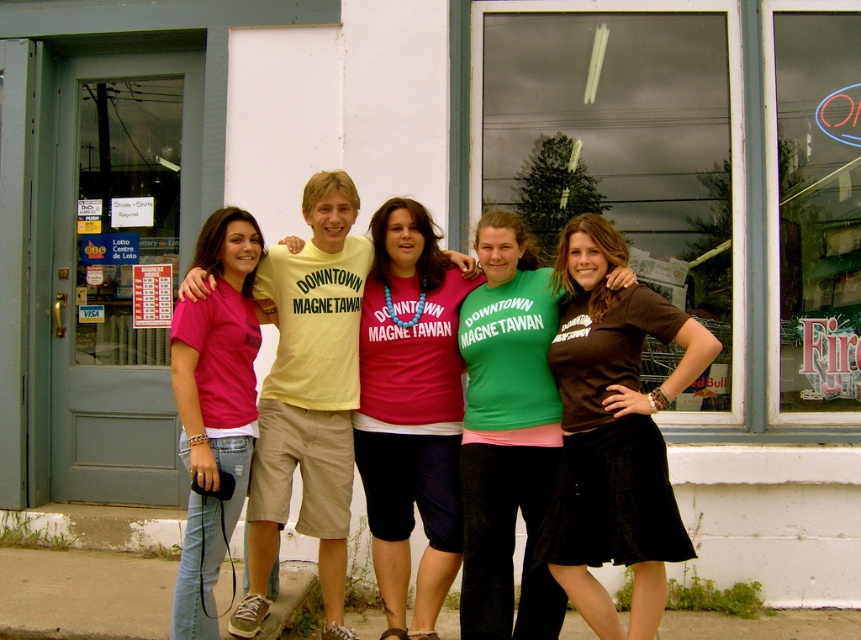
Does matte pink shirt at center have a greater height compared to green matte shirt at center?

Correct, matte pink shirt at center is much taller as green matte shirt at center.

Based on the photo, which is below, matte pink shirt at center or green matte shirt at center?

green matte shirt at center is below.

Which is in front, point (422, 280) or point (462, 472)?

Point (462, 472) is in front.

Image resolution: width=861 pixels, height=640 pixels. I want to click on matte pink shirt at center, so click(410, 412).

Can you confirm if matte pink shirt at center is positioned below matte pink t-shirt at left?

Indeed, matte pink shirt at center is positioned under matte pink t-shirt at left.

Can you confirm if matte pink shirt at center is positioned above matte pink t-shirt at left?

No.

You are a GUI agent. You are given a task and a screenshot of the screen. Output one action in this format:
    pyautogui.click(x=<x>, y=<y>)
    Task: Click on the matte pink shirt at center
    This screenshot has height=640, width=861.
    Given the screenshot: What is the action you would take?
    pyautogui.click(x=410, y=412)

How far apart are brown cotton shirt at center and matte pink t-shirt at left?

The distance of brown cotton shirt at center from matte pink t-shirt at left is 4.22 feet.

Measure the distance between brown cotton shirt at center and camera.

brown cotton shirt at center is 12.26 feet from camera.

Where is `brown cotton shirt at center`? The width and height of the screenshot is (861, 640). brown cotton shirt at center is located at coordinates (612, 433).